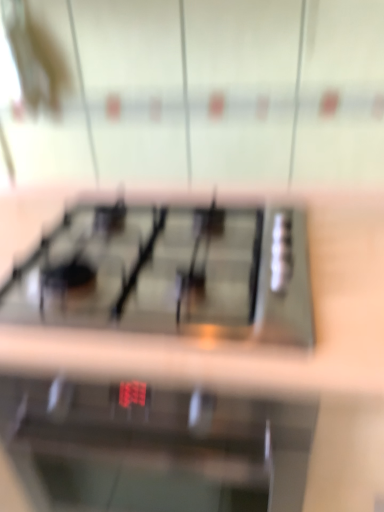
The height and width of the screenshot is (512, 384). Describe the element at coordinates (170, 273) in the screenshot. I see `metallic silver gas stove at center` at that location.

Measure the distance between point (255,262) and camera.

Point (255,262) and camera are 35.94 inches apart from each other.

Locate an element on the screen. The image size is (384, 512). metallic silver gas stove at center is located at coordinates (170, 273).

Find the location of a particular element. The width and height of the screenshot is (384, 512). metallic silver gas stove at center is located at coordinates (170, 273).